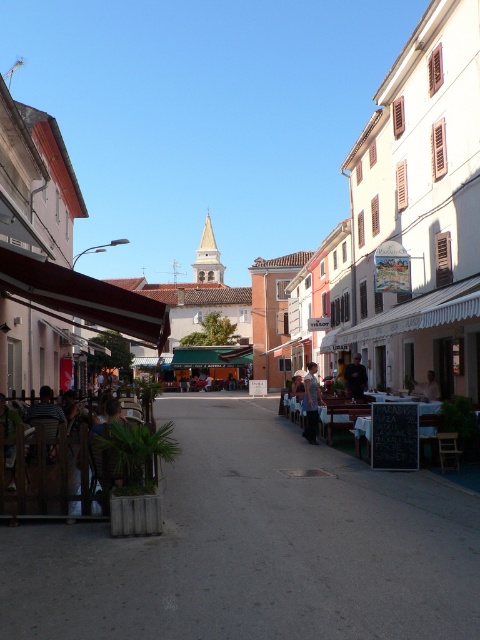
You are standing on the concrete pavement at center. Where exactly are you located in the scene?

The concrete pavement at center is located at point (255, 547) in the scene.

You are standing in the European town square and want to walk towards the two points marked in the image. Which point, point (x=455, y=577) or point (x=432, y=396), will you reach first?

You will reach point (x=455, y=577) first because it is closer to you than point (x=432, y=396).

You are a delivery person carrying a package that is 1 meter wide. You are standing on the concrete pavement at center and need to pass by the light brown leather jacket at center. Can your package fit through the space between them?

The concrete pavement at center might be wider than the light brown leather jacket at center, so there is a possibility that the space between them is wide enough for the 1 meter wide package. However, since the exact width difference isn not specified, it is recommended to check the actual space before proceeding.